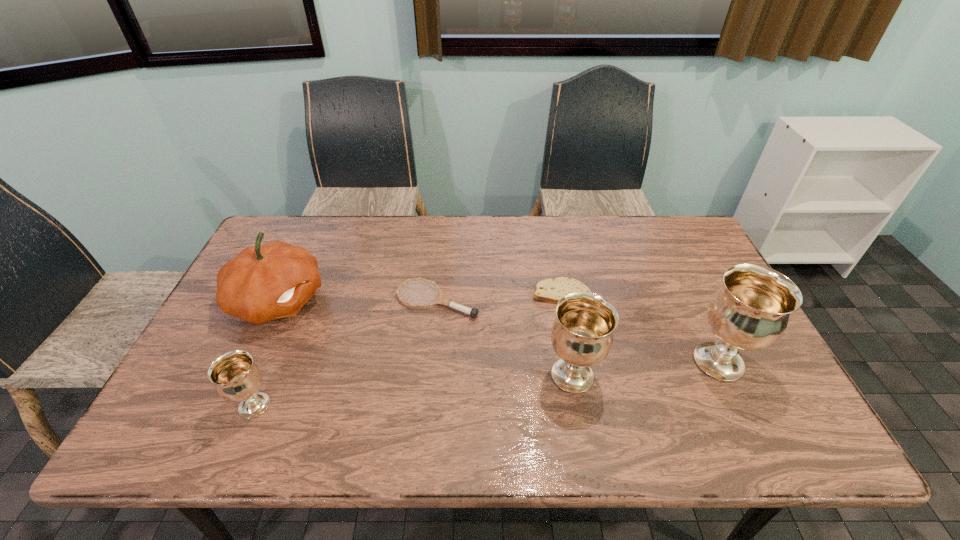
At what (x,y) coordinates should I click in order to perform the action: click on the leftmost chalice. Please return your answer as a coordinate pair (x, y). The height and width of the screenshot is (540, 960). Looking at the image, I should click on (236, 377).

Where is `the shortest chalice`? The image size is (960, 540). the shortest chalice is located at coordinates pos(236,377).

You are a GUI agent. You are given a task and a screenshot of the screen. Output one action in this format:
    pyautogui.click(x=<x>, y=<y>)
    Task: Click on the second shortest chalice
    The height and width of the screenshot is (540, 960).
    Given the screenshot: What is the action you would take?
    pyautogui.click(x=582, y=334)

In order to click on the rightmost chalice in this screenshot , I will do `click(750, 311)`.

The height and width of the screenshot is (540, 960). In order to click on the fourth object from right to left in this screenshot , I will do [473, 312].

I want to click on pumpkin, so click(262, 283).

What are the coordinates of `the shortest object` in the screenshot? It's located at (549, 290).

The height and width of the screenshot is (540, 960). I want to click on vacant region located 0.140m on the right of the shortest chalice, so click(x=334, y=406).

Find the location of a particular element. free space located 0.400m on the left of the second chalice from right to left is located at coordinates (383, 375).

At what (x,y) coordinates should I click in order to perform the action: click on free location located 0.320m on the left of the rightmost object. Please return your answer as a coordinate pair (x, y). Image resolution: width=960 pixels, height=540 pixels. Looking at the image, I should click on (562, 362).